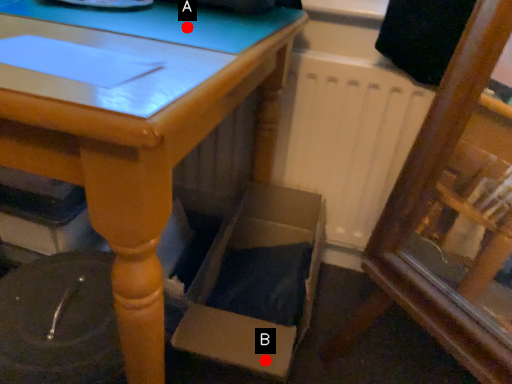
Question: Two points are circled on the image, labeled by A and B beside each circle. Which point appears closest to the camera in this image?

Choices:
 (A) A is closer
 (B) B is closer

Answer: (A)